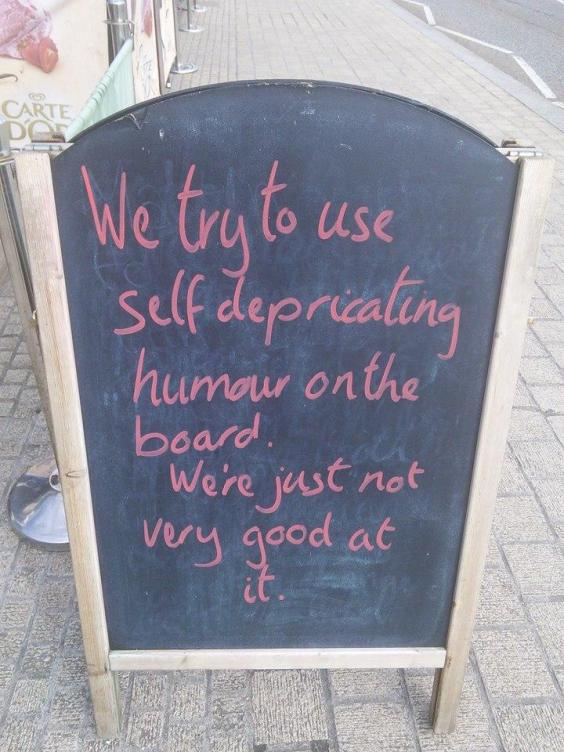
Find the location of a particular element. The image size is (564, 752). blackboard is located at coordinates (431, 228).